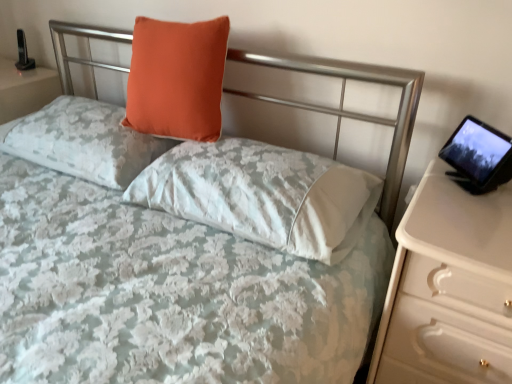
Question: From the image's perspective, is white glossy nightstand at right positioned above or below matte orange pillow at upper left, placed as the first pillow when sorted from left to right?

Choices:
 (A) below
 (B) above

Answer: (A)

Question: Is white glossy nightstand at right inside or outside of matte orange pillow at upper left, placed as the first pillow when sorted from left to right?

Choices:
 (A) outside
 (B) inside

Answer: (A)

Question: Which object is positioned closest to the orange velvet pillow at upper center, the second pillow in the left-to-right sequence?

Choices:
 (A) black glossy tablet at right
 (B) orange fabric pillow at upper center, the first pillow in the right-to-left sequence
 (C) white glossy nightstand at right
 (D) matte orange pillow at upper left, which ranks as the 3th pillow in right-to-left order

Answer: (D)

Question: Estimate the real-world distances between objects in this image. Which object is closer to the matte orange pillow at upper left, which ranks as the 3th pillow in right-to-left order?

Choices:
 (A) black glossy tablet at right
 (B) orange fabric pillow at upper center, the 3th pillow when ordered from left to right
 (C) orange velvet pillow at upper center, which is the 2th pillow from right to left
 (D) white glossy nightstand at right

Answer: (C)